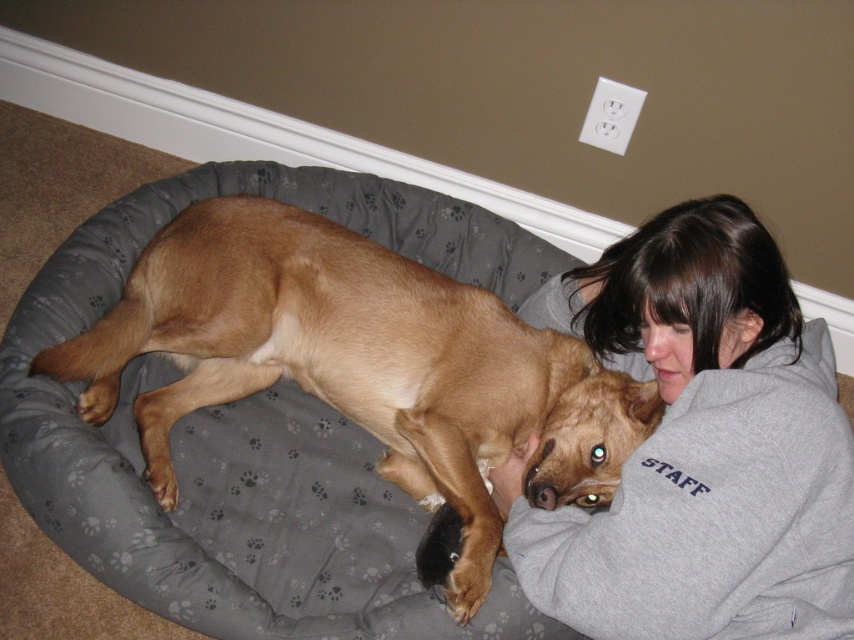
Question: Can you confirm if brown smooth dog at center is positioned to the left of gray fleece sweatshirt at upper right?

Choices:
 (A) no
 (B) yes

Answer: (B)

Question: Considering the relative positions of brown smooth dog at center and gray fleece sweatshirt at upper right in the image provided, where is brown smooth dog at center located with respect to gray fleece sweatshirt at upper right?

Choices:
 (A) below
 (B) above

Answer: (B)

Question: Can you confirm if brown smooth dog at center is wider than gray fleece sweatshirt at upper right?

Choices:
 (A) no
 (B) yes

Answer: (B)

Question: Which object appears farthest from the camera in this image?

Choices:
 (A) brown smooth dog at center
 (B) gray fleece sweatshirt at upper right

Answer: (A)